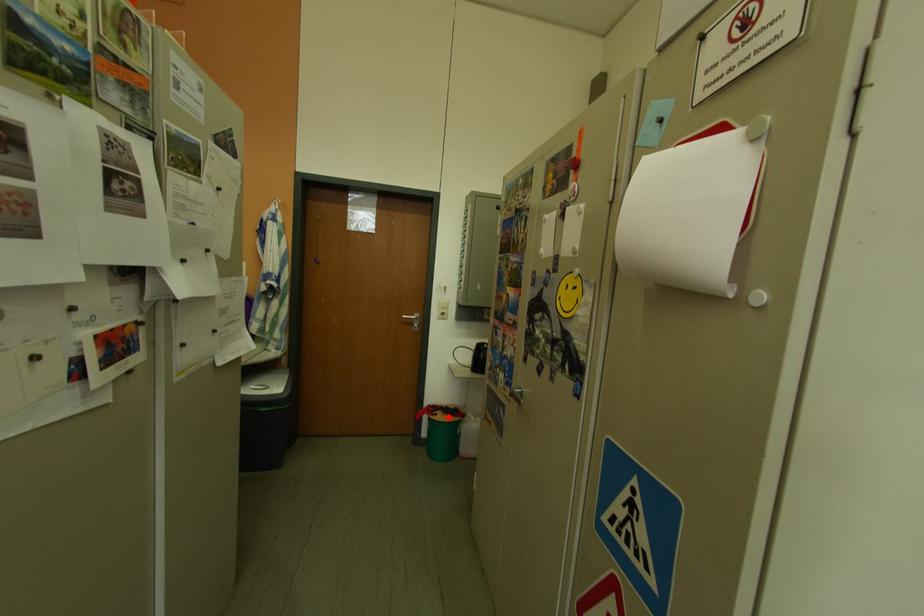
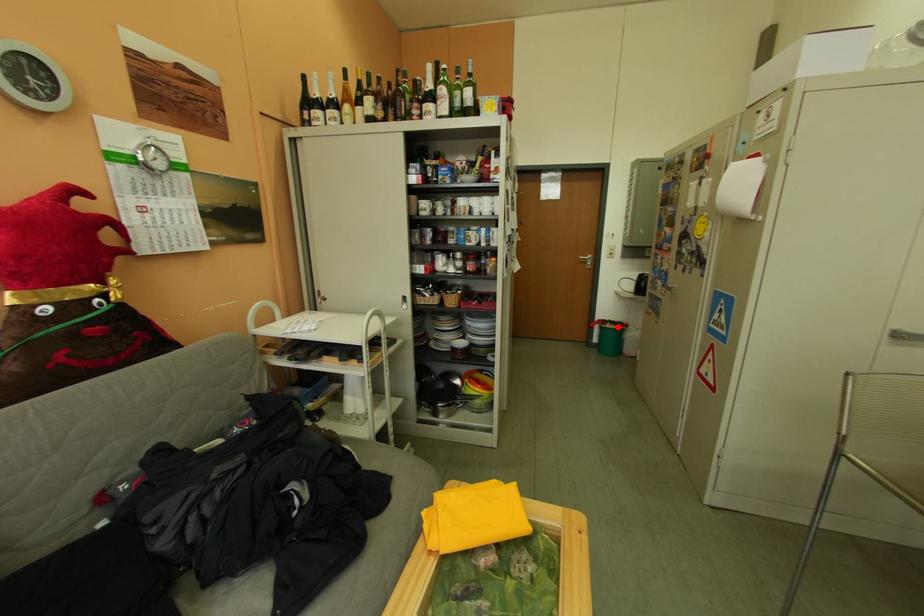
I am providing you with two images of the same scene from different viewpoints. A red point is marked on the first image and another point is marked on the second image. Does the point marked in image1 correspond to the same location as the one in image2?

Yes